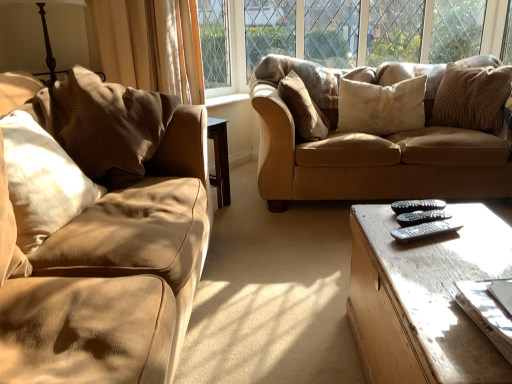
Locate an element on the screen. This screenshot has height=384, width=512. vacant space situated on the left part of black plastic remote at center, positioned as the third remote in front-to-back order is located at coordinates (379, 212).